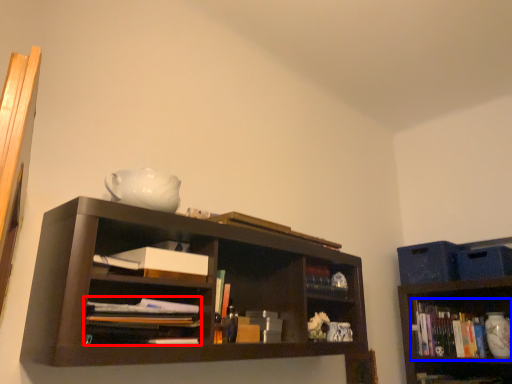
Question: Among these objects, which one is nearest to the camera, book (highlighted by a red box) or book (highlighted by a blue box)?

Choices:
 (A) book
 (B) book

Answer: (A)